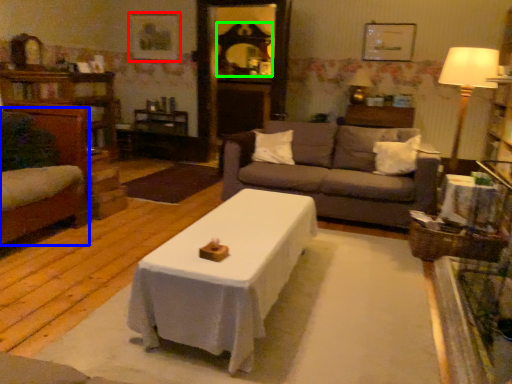
Question: Estimate the real-world distances between objects in this image. Which object is closer to picture frame (highlighted by a red box), swivel chair (highlighted by a blue box) or mirror (highlighted by a green box)?

Choices:
 (A) swivel chair
 (B) mirror

Answer: (B)